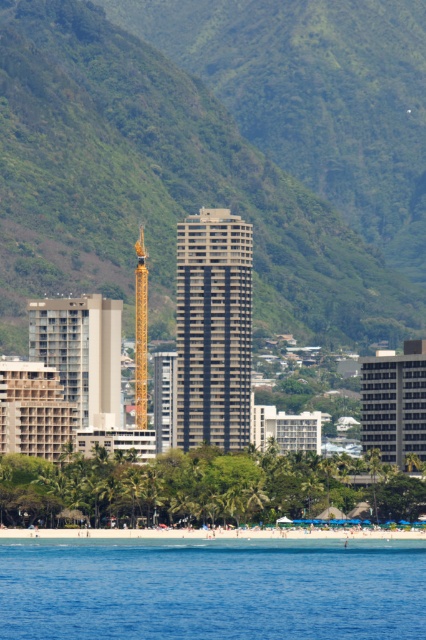
Question: Is white sand beach at lower center wider than gold metallic crane at center?

Choices:
 (A) no
 (B) yes

Answer: (B)

Question: Is green leafy hill at center smaller than blue liquid water at lower center?

Choices:
 (A) no
 (B) yes

Answer: (A)

Question: Does green leafy hill at center appear over gold metallic crane at center?

Choices:
 (A) no
 (B) yes

Answer: (B)

Question: Which of these objects is positioned closest to the white sand beach at lower center?

Choices:
 (A) blue liquid water at lower center
 (B) gold metallic crane at center

Answer: (A)

Question: Which point is closer to the camera?

Choices:
 (A) (108, 145)
 (B) (37, 536)
 (C) (138, 403)

Answer: (C)

Question: Which point is farther from the camera taking this photo?

Choices:
 (A) (66, 236)
 (B) (236, 593)

Answer: (B)